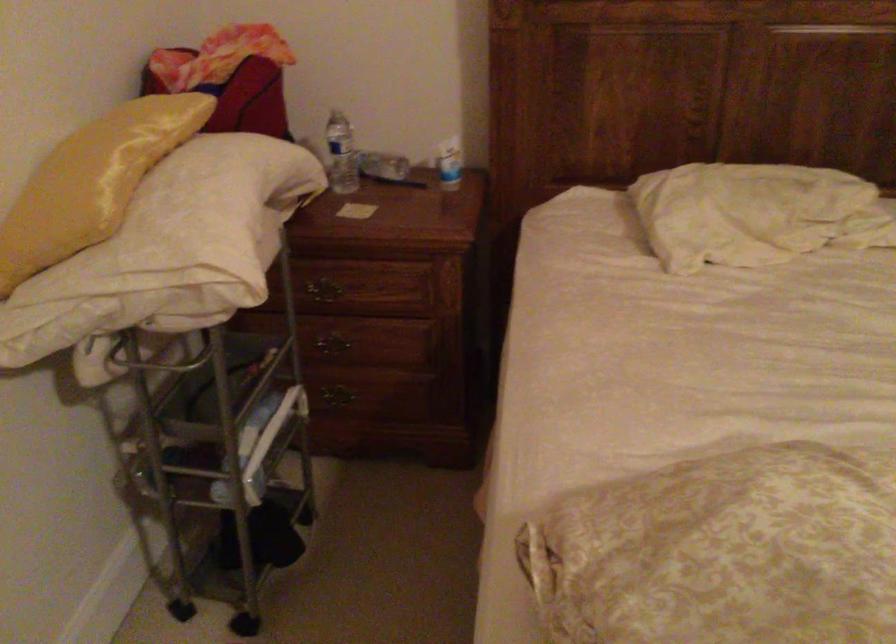
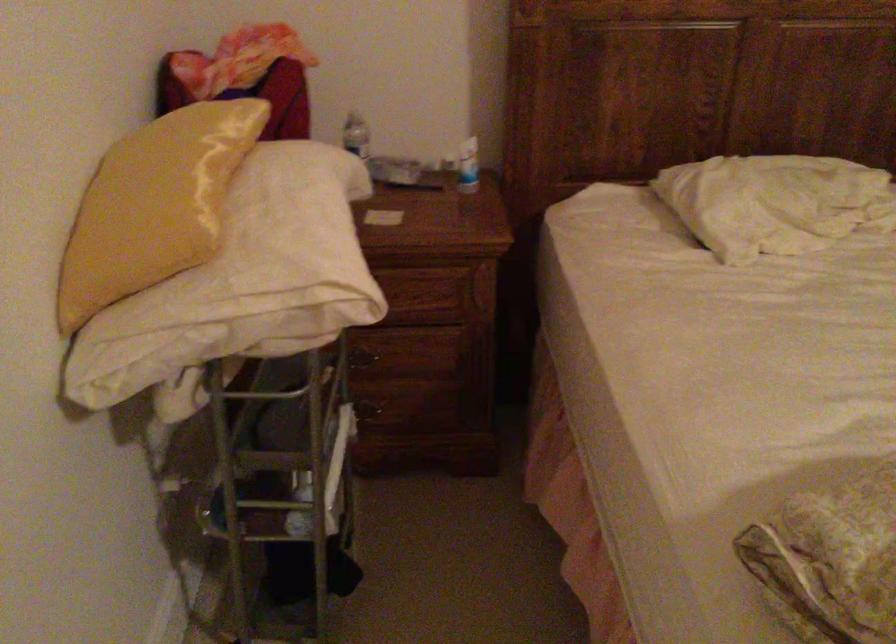
The point at (382, 355) is marked in the first image. Where is the corresponding point in the second image?

(412, 365)